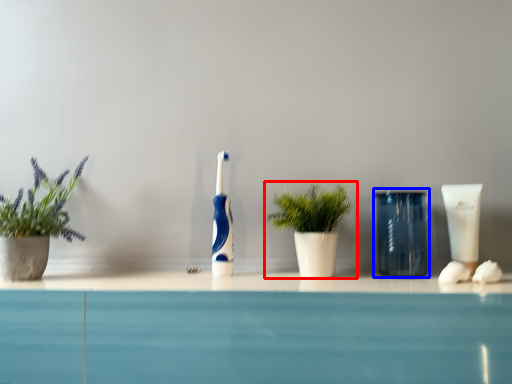
Question: Which object appears farthest to the camera in this image, houseplant (highlighted by a red box) or glass vase (highlighted by a blue box)?

Choices:
 (A) houseplant
 (B) glass vase

Answer: (B)